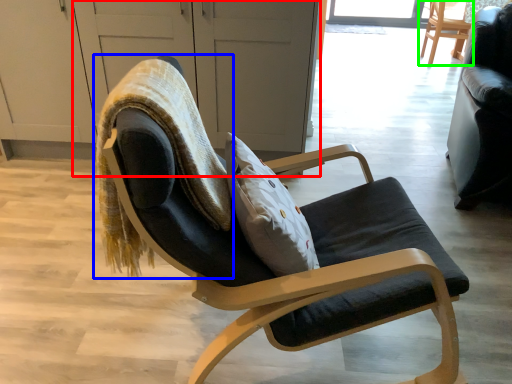
Question: Considering the real-world distances, which object is farthest from screen door (highlighted by a red box)? bean bag chair (highlighted by a blue box) or chair (highlighted by a green box)?

Choices:
 (A) bean bag chair
 (B) chair

Answer: (B)